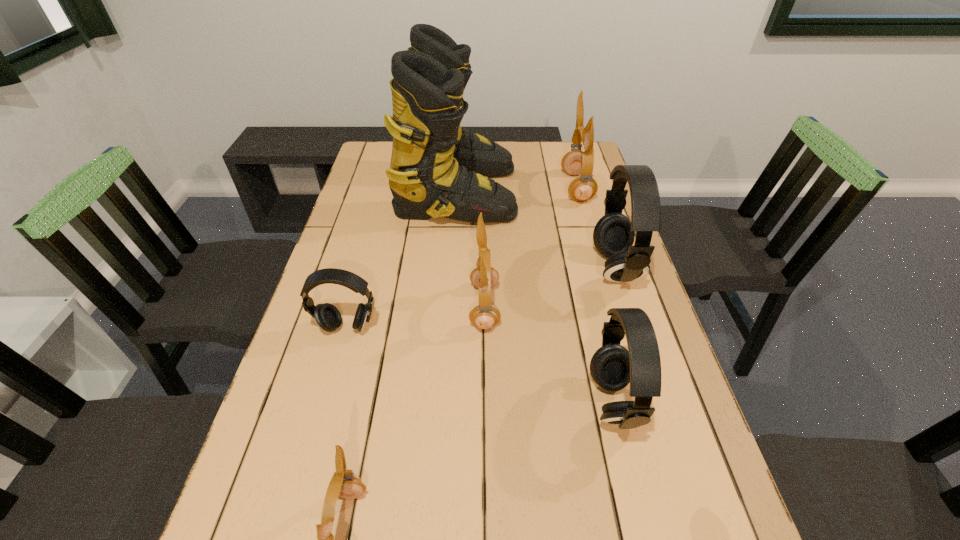
Find the location of `free space located 0.200m on the front of the ski boots`. free space located 0.200m on the front of the ski boots is located at coordinates (451, 278).

Where is `blank space located 0.110m on the front-facing side of the farthest brown earphone`? blank space located 0.110m on the front-facing side of the farthest brown earphone is located at coordinates (531, 187).

This screenshot has height=540, width=960. In order to click on vacant space located 0.250m on the front-facing side of the farthest brown earphone in this screenshot , I will do `click(491, 187)`.

At what (x,y) coordinates should I click in order to perform the action: click on free space located 0.390m on the front-facing side of the farthest brown earphone. Please return your answer as a coordinate pair (x, y). The image size is (960, 540). Looking at the image, I should click on (450, 187).

At what (x,y) coordinates should I click in order to perform the action: click on vacant space located 0.220m on the ear cups of the biggest black earphone. Please return your answer as a coordinate pair (x, y). The width and height of the screenshot is (960, 540). Looking at the image, I should click on (515, 268).

Where is `vacant region located 0.260m on the ear cups of the biggest black earphone`? The height and width of the screenshot is (540, 960). vacant region located 0.260m on the ear cups of the biggest black earphone is located at coordinates (500, 268).

Locate an element on the screen. This screenshot has width=960, height=540. vacant space located 0.220m on the ear cups of the biggest black earphone is located at coordinates pos(515,268).

The height and width of the screenshot is (540, 960). What are the coordinates of `vacant space located 0.080m on the front-facing side of the second nearest brown earphone` in the screenshot? It's located at (439, 307).

Where is `vacant space located 0.110m on the front-facing side of the second nearest brown earphone`? The image size is (960, 540). vacant space located 0.110m on the front-facing side of the second nearest brown earphone is located at coordinates (426, 307).

Identify the location of vacant space located on the front-facing side of the second nearest brown earphone. (384, 307).